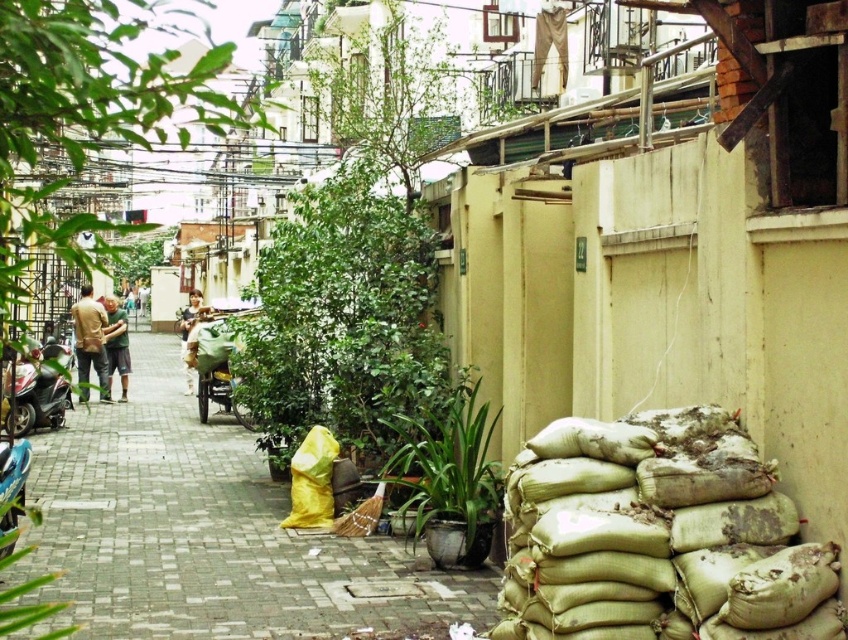
You are standing at the entrance of the alley and want to walk towards the sandbags on the right side. There are two points marked in the alley, point A at coordinates point A is point (92, 356) and point B at coordinates point B is point (110, 308). Which point should you step on first if you want to reach the sandbags as quickly as possible?

You should step on point A first because it is closer to the viewer than point B, meaning it is nearer to your starting position at the alley entrance.

You are a delivery person with a package that needs to be delivered to the green matte shirt at center. Your shiny metallic scooter at left can carry a maximum load of 3 meters. Can you safely transport the package from the scooter to the shirt without exceeding the scooter?

The distance between the shiny metallic scooter at left and the green matte shirt at center is 2.97 meters, which is within the scooter maximum load capacity of 3 meters. Therefore, you can safely transport the package from the shiny metallic scooter at left to the green matte shirt at center without exceeding the scooter.

You are standing at the entrance of the alley and see the brown leather jacket at center. If you want to reach the jacket, should you walk towards the right side or the left side of the alley?

The brown leather jacket at center is located at point (91,342), which is closer to the center of the alley. Therefore, you should walk straight ahead towards the center to reach it.